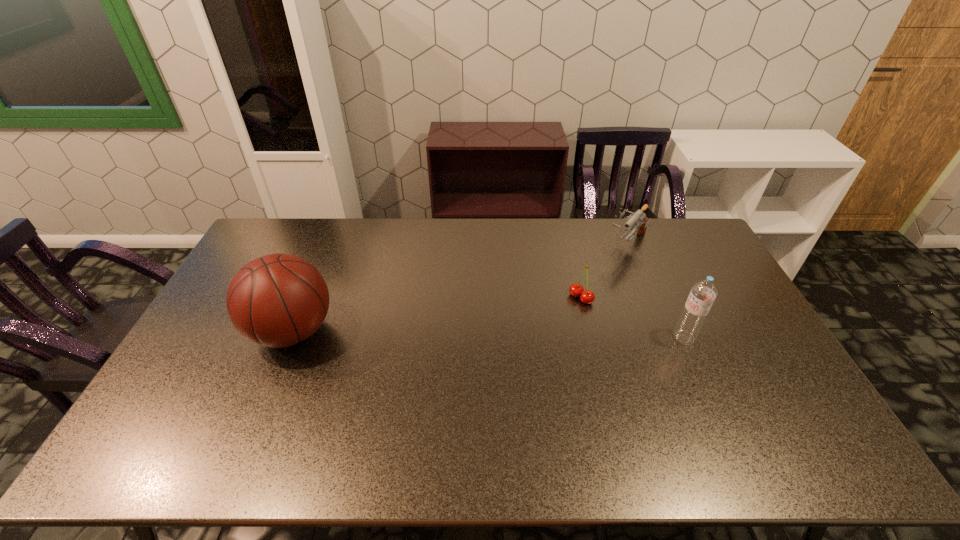
Locate an element on the screen. This screenshot has width=960, height=540. free space on the desktop that is between the basketball and the water bottle and is positioned with the stems of the second object from left to right pointing upwards is located at coordinates (538, 335).

Where is `free spot on the desktop that is between the leftmost object and the water bottle and is positioned at the barrel end of the gun`? The width and height of the screenshot is (960, 540). free spot on the desktop that is between the leftmost object and the water bottle and is positioned at the barrel end of the gun is located at coordinates (545, 335).